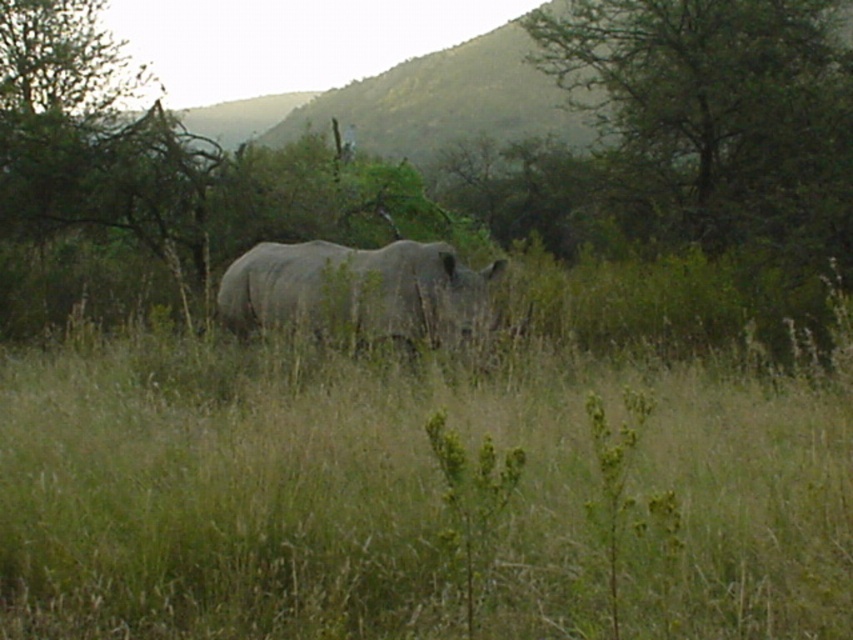
You are an animal tracker observing the scene. You need to determine the relative positions of the green leafy tree at upper right and the gray matte rhinoceros at center. Which object is higher in the image?

The green leafy tree at upper right is above the gray matte rhinoceros at center, so the green leafy tree at upper right is higher in the image.

You are navigating through a rhinoceros habitat and need to place a camera at one of two points to monitor the rhino. The points are located at coordinates point (735, 51) and point (436, 264). Based on their positions relative to the rhino, which point is closer to the rhino?

Point (436, 264) is closer to the rhino because it is in front of point (735, 51), which is behind it.

You are a wildlife photographer trying to capture a clear shot of the gray matte rhinoceros at center. However, the green leafy tree at upper right is blocking your view. Can you determine if the tree is closer to you or farther away than the rhinoceros?

The green leafy tree at upper right has a larger size compared to the gray matte rhinoceros at center. Since larger objects in the foreground appear bigger than those in the background, the tree is closer to you than the rhinoceros.